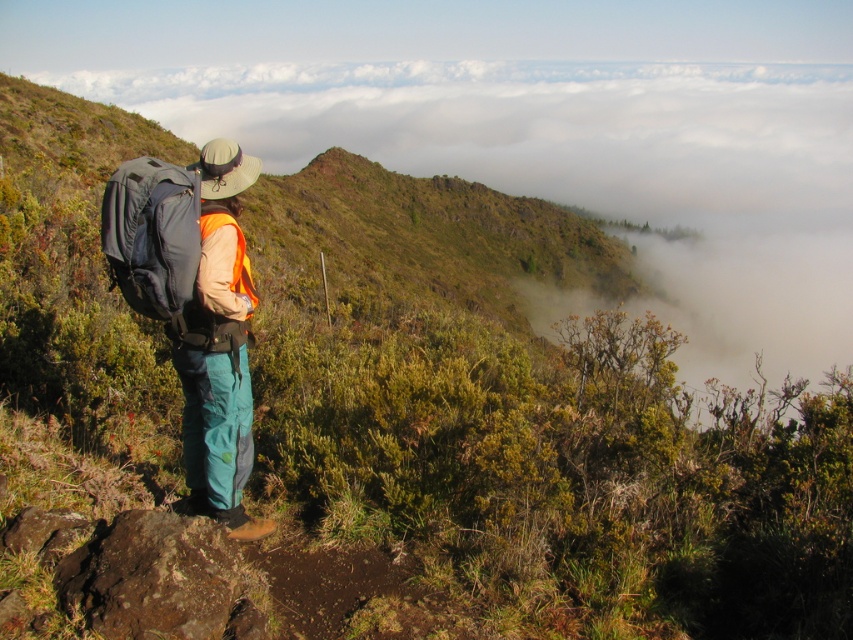
Does point (189, 312) come closer to viewer compared to point (154, 157)?

Yes, it is.

This screenshot has width=853, height=640. Describe the element at coordinates (218, 348) in the screenshot. I see `matte blue backpack at center` at that location.

The image size is (853, 640). Describe the element at coordinates (218, 348) in the screenshot. I see `matte blue backpack at center` at that location.

I want to click on matte blue backpack at center, so point(218,348).